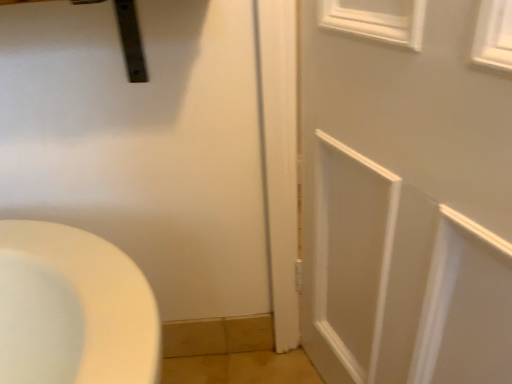
Question: Should I look upward or downward to see white painted wood door at center?

Choices:
 (A) up
 (B) down

Answer: (B)